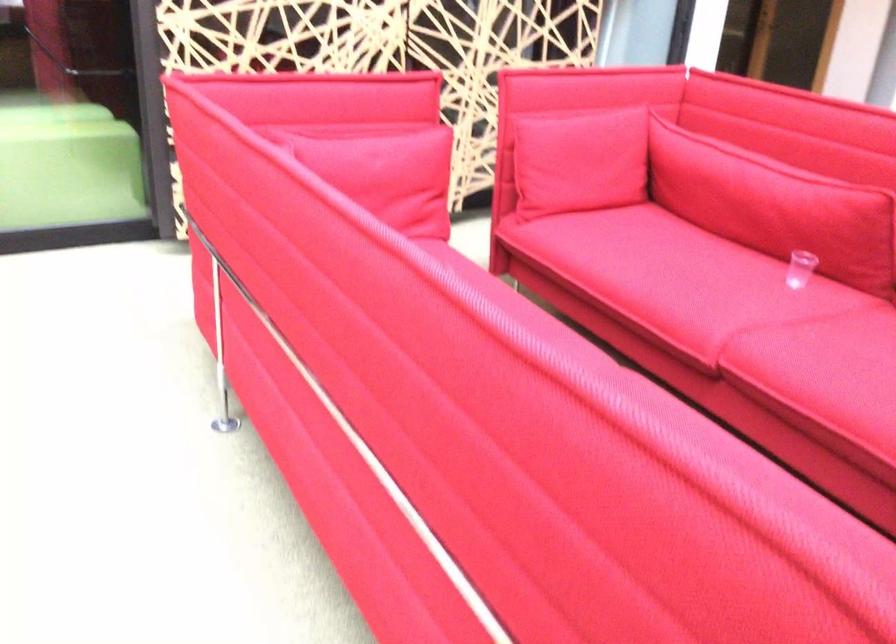
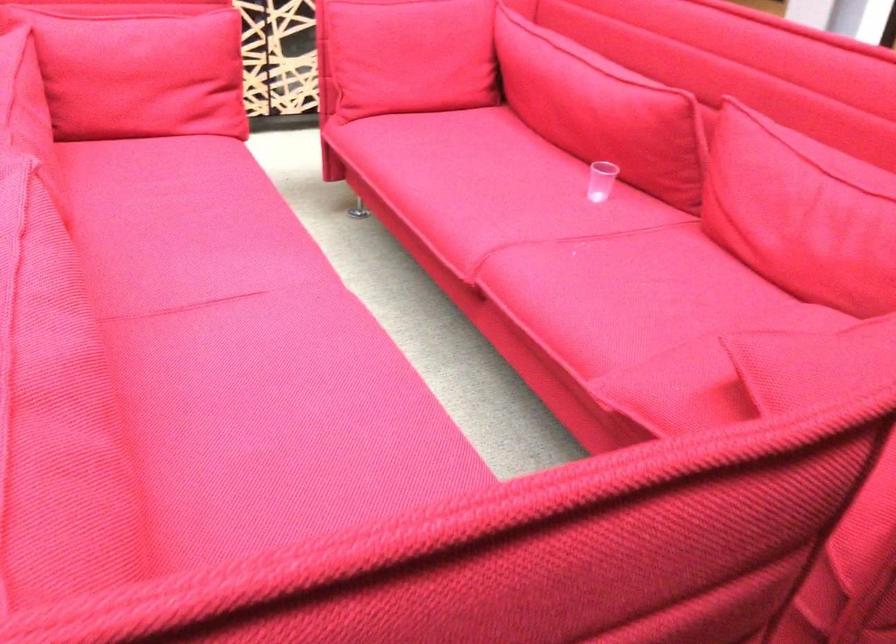
In the second image, find the point that corresponds to point (784, 200) in the first image.

(601, 109)